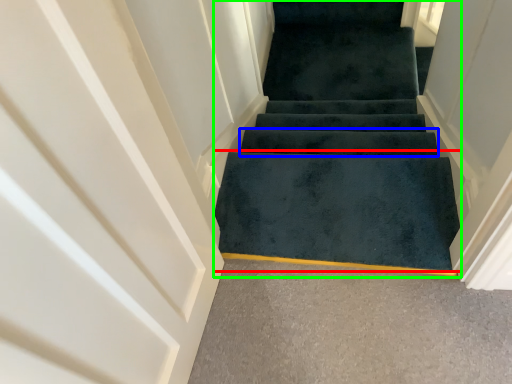
Question: Which is farther away from doormat (highlighted by a red box)? stair (highlighted by a blue box) or stairs (highlighted by a green box)?

Choices:
 (A) stair
 (B) stairs

Answer: (B)